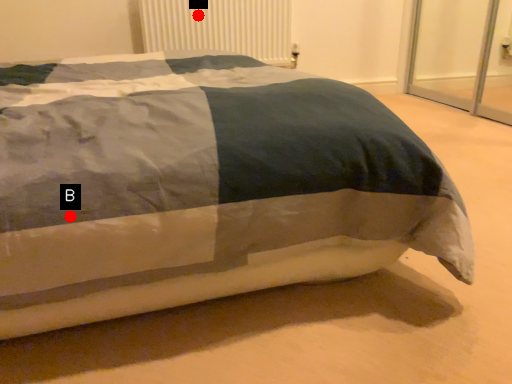
Question: Two points are circled on the image, labeled by A and B beside each circle. Which point is farther to the camera?

Choices:
 (A) A is further
 (B) B is further

Answer: (A)